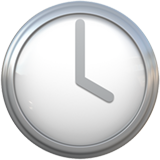
I want to click on clock, so click(123, 72).